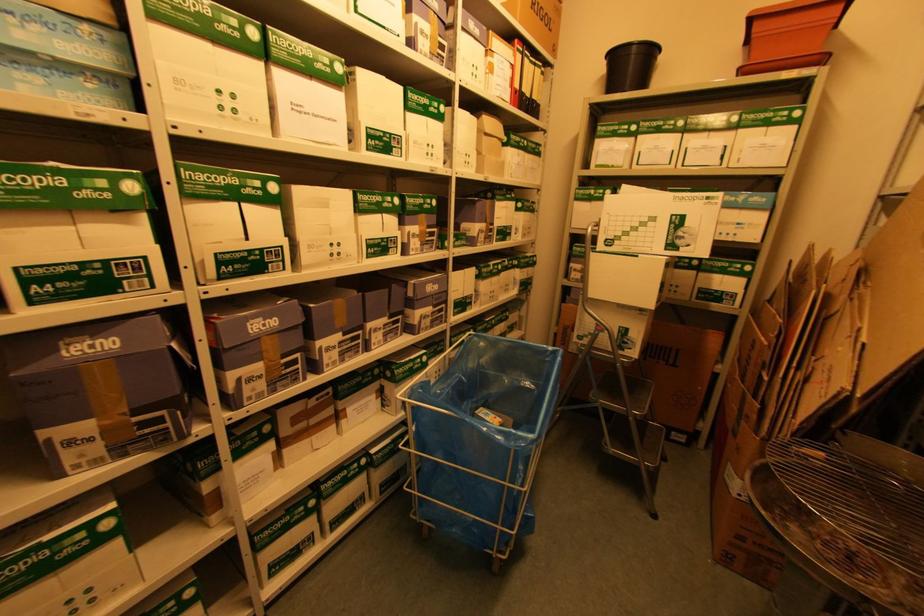
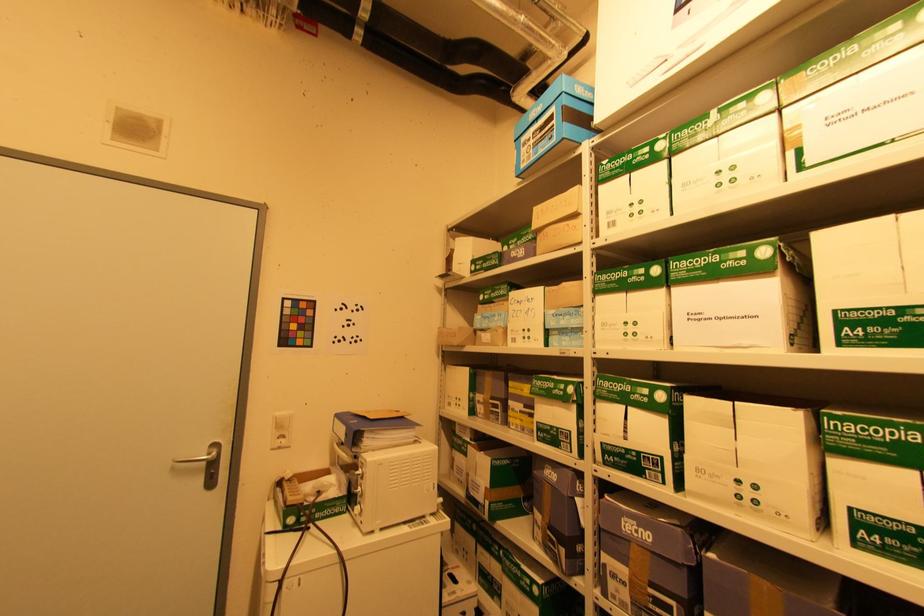
Question: The images are taken continuously from a first-person perspective. In which direction is your viewpoint rotating?

Choices:
 (A) Left
 (B) Right
 (C) Up
 (D) Down

Answer: (A)